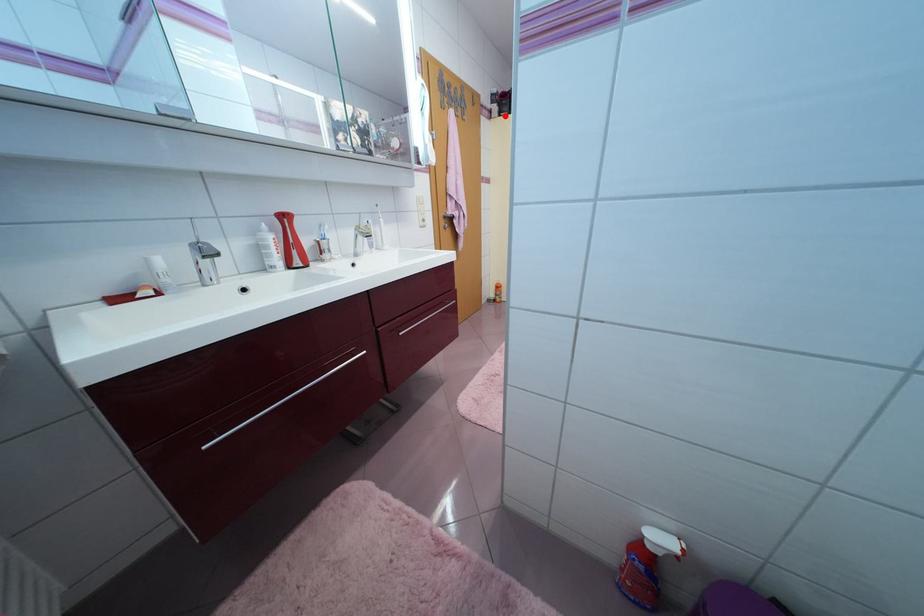
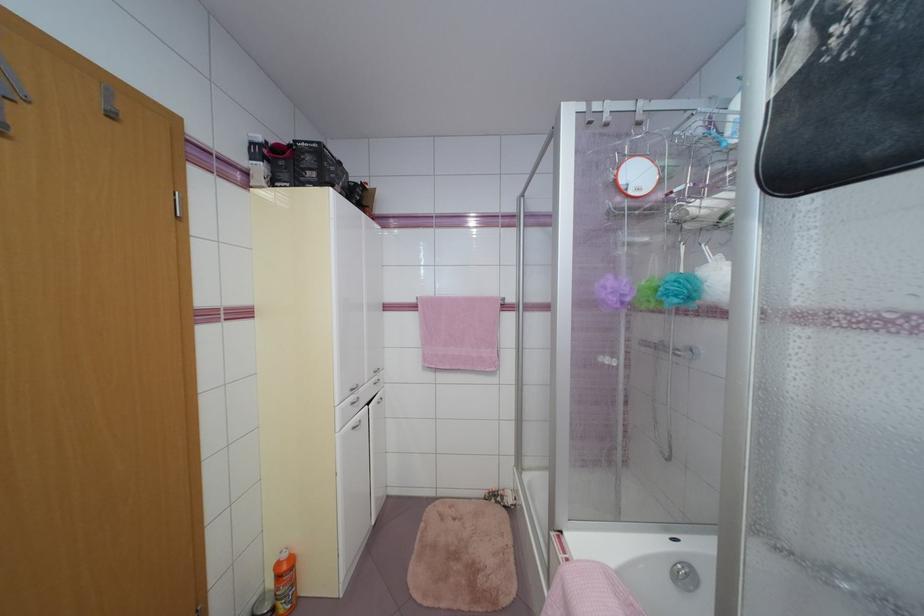
Question: A red point is marked in image1. In image2, is the corresponding 3D point closer to the camera or farther? Reply with the corresponding letter.

Choices:
 (A) The corresponding 3D point is closer.
 (B) The corresponding 3D point is farther.

Answer: (B)